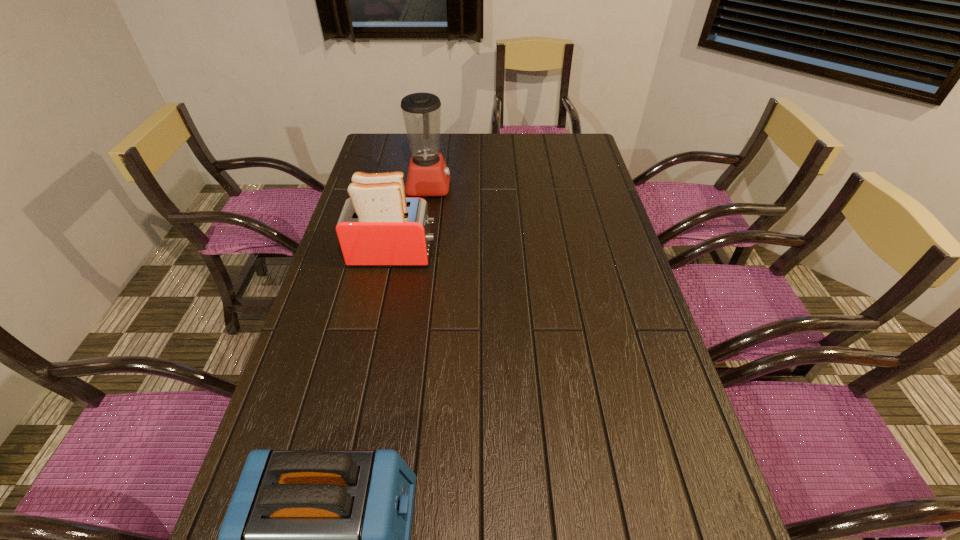
Identify the location of the farthest object. (428, 175).

Where is `the tallest object`? This screenshot has height=540, width=960. the tallest object is located at coordinates [428, 175].

Image resolution: width=960 pixels, height=540 pixels. I want to click on the farther toaster, so click(x=378, y=227).

What are the coordinates of `free location located 0.230m on the front of the farthest object near the controls` in the screenshot? It's located at click(x=514, y=186).

The height and width of the screenshot is (540, 960). What are the coordinates of `free space located on the front-facing side of the farther toaster` in the screenshot? It's located at (469, 254).

I want to click on object that is at the left edge, so click(x=378, y=227).

Image resolution: width=960 pixels, height=540 pixels. In order to click on free space at the far edge of the desktop in this screenshot , I will do `click(532, 142)`.

You are a GUI agent. You are given a task and a screenshot of the screen. Output one action in this format:
    pyautogui.click(x=<x>, y=<y>)
    Task: Click on the vacant space at the left edge of the desktop
    The width and height of the screenshot is (960, 540).
    Given the screenshot: What is the action you would take?
    (x=340, y=410)

In the image, there is a desktop. Identify the location of vacant space at the right edge. (604, 198).

Identify which object is located as the second nearest to the farthest object. Please provide its 2D coordinates. Your answer should be formatted as a tuple, i.e. [(x, y)], where the tuple contains the x and y coordinates of a point satisfying the conditions above.

[(312, 539)]